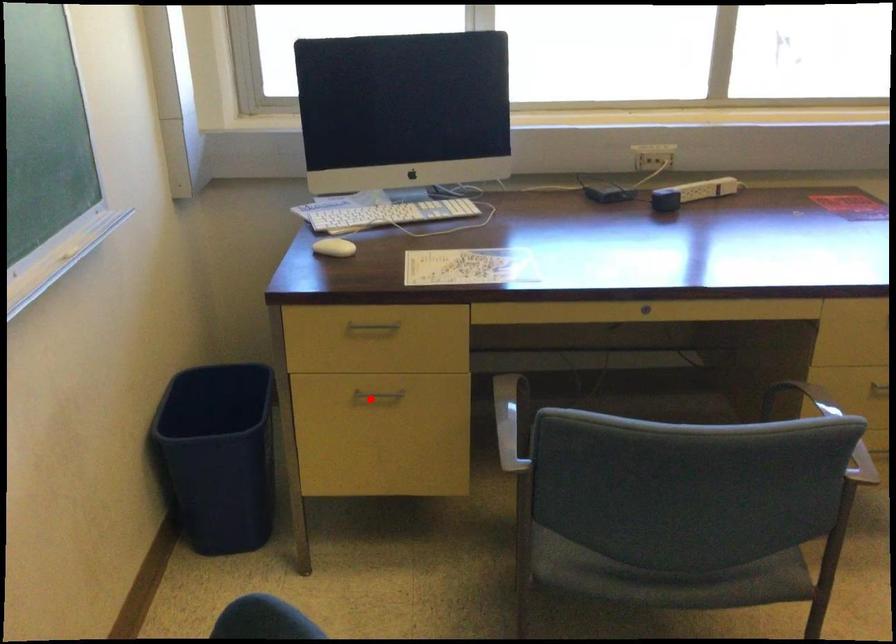
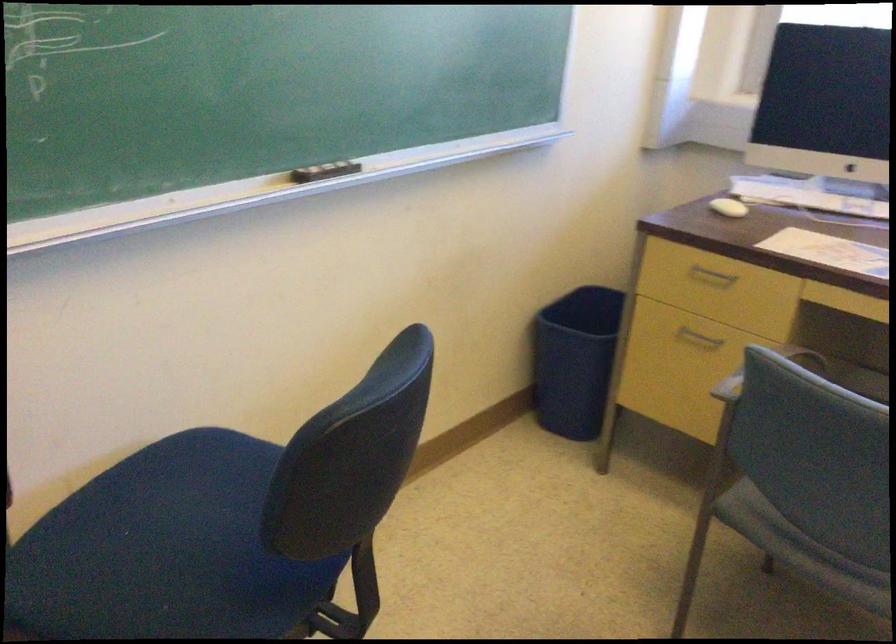
Question: I am providing you with two images of the same scene from different viewpoints. A red point is marked on the first image. Is the red point's position out of view in image 2?

Choices:
 (A) Yes
 (B) No

Answer: (B)